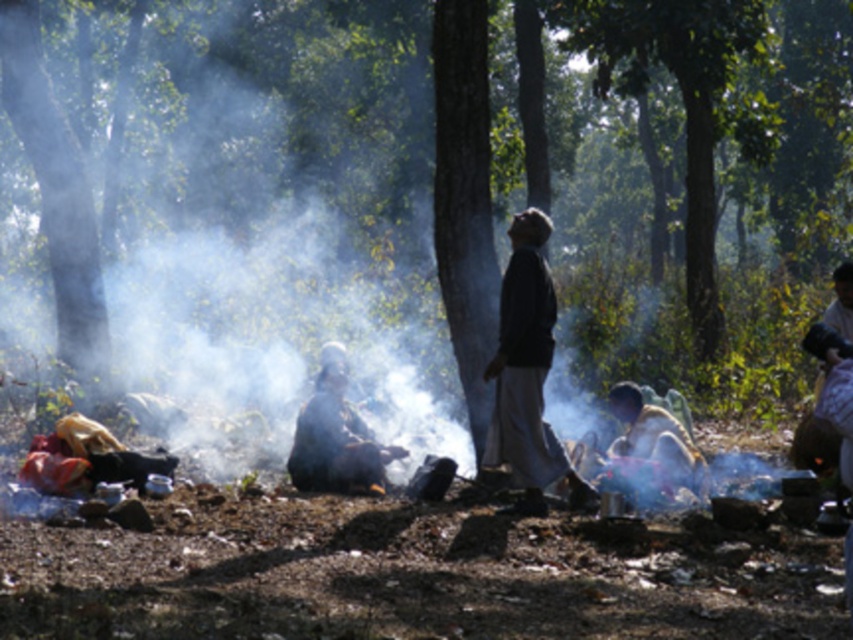
Question: Which object is positioned farthest from the dark brown fabric at center?

Choices:
 (A) dark gray fabric at center
 (B) floral fabric dress at right

Answer: (B)

Question: Can you confirm if dark brown fabric at center is positioned below dark gray fabric at center?

Choices:
 (A) yes
 (B) no

Answer: (B)

Question: From the image, what is the correct spatial relationship of dark brown fabric at center in relation to floral fabric dress at right?

Choices:
 (A) above
 (B) below

Answer: (A)

Question: Is dark brown fabric at center to the right of dark gray fabric at center from the viewer's perspective?

Choices:
 (A) yes
 (B) no

Answer: (A)

Question: Among these points, which one is nearest to the camera?

Choices:
 (A) (527, 474)
 (B) (846, 282)

Answer: (A)

Question: Among these points, which one is farthest from the camera?

Choices:
 (A) (288, 470)
 (B) (844, 316)

Answer: (A)